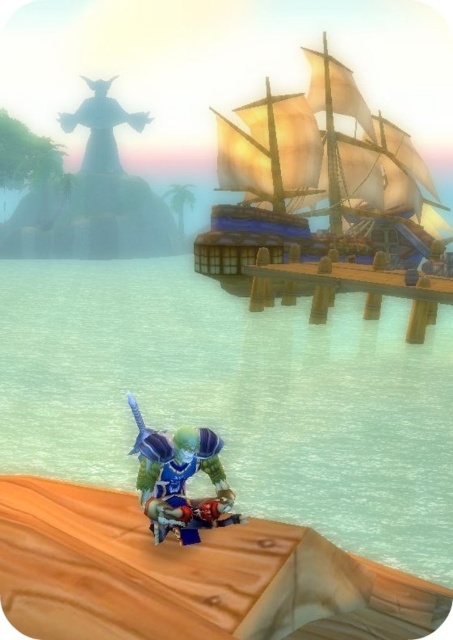
You are a character standing on the wooden dock. You need to retrieve your sword from the translucent blue water at lower center, but there is a wooden ship at upper right nearby. Can you reach the water without getting on the ship?

The translucent blue water at lower center is below the wooden ship at upper right, so you can reach the water without getting on the ship by moving around it or staying below the ship.

You are a character in this scene and want to cross from the dock to the ship in the background. The blue metallic armor at center is blocking your path. Can you move around it to reach the ship, considering the translucent blue water at lower center is to its left?

The translucent blue water at lower center is positioned on the left side of the blue metallic armor at center, so you can move around the blue metallic armor at center by going to its left side towards the translucent blue water at lower center to reach the ship.

You are a character in this fantasy world and need to cross from the dock to the wooden ship at upper right. The translucent blue water at lower center is part of your path. Considering their sizes, which object would require more careful navigation?

The wooden ship at upper right requires more careful navigation because it is larger in size compared to the translucent blue water at lower center.